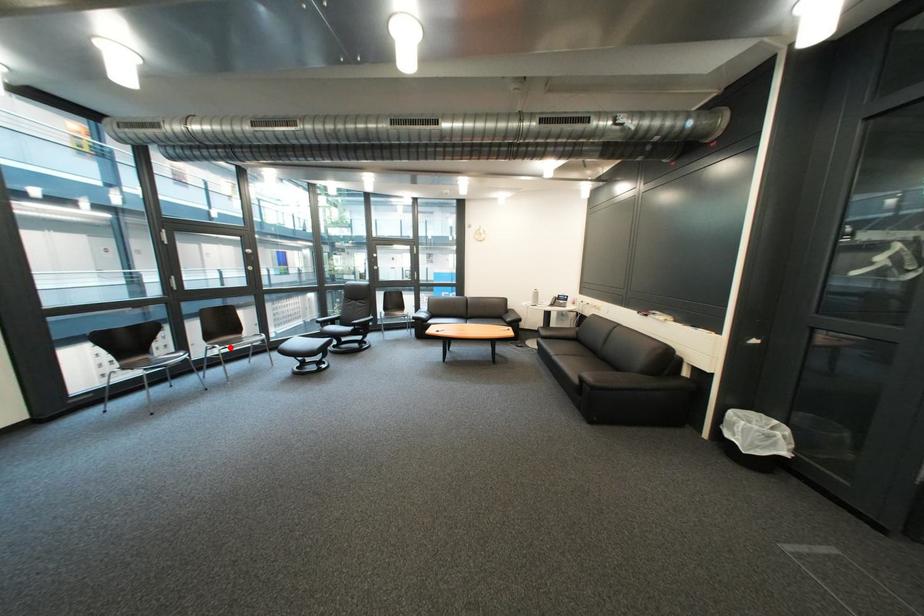
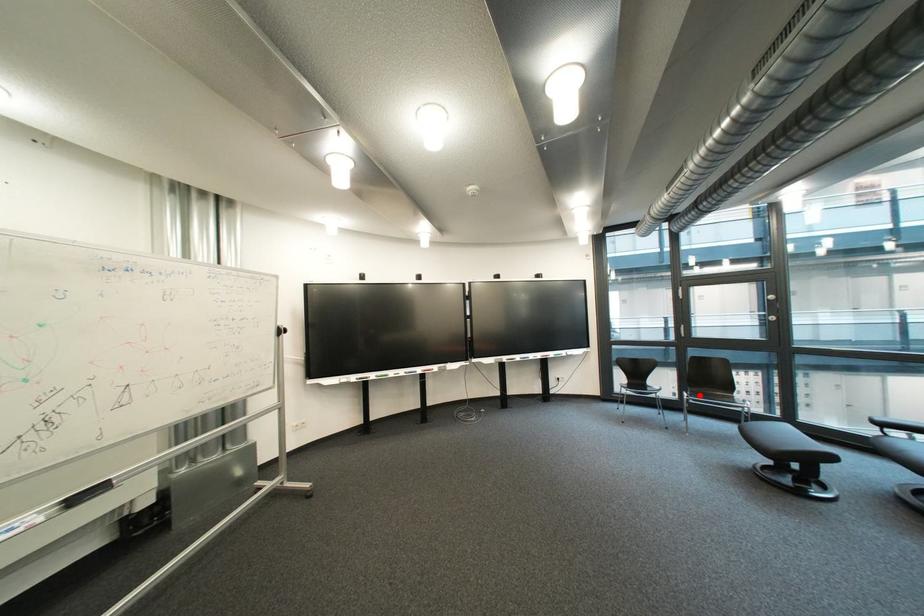
I am providing you with two images of the same scene from different viewpoints. A red point is marked on the first image and another point is marked on the second image. Do the highlighted points in image1 and image2 indicate the same real-world spot?

Yes